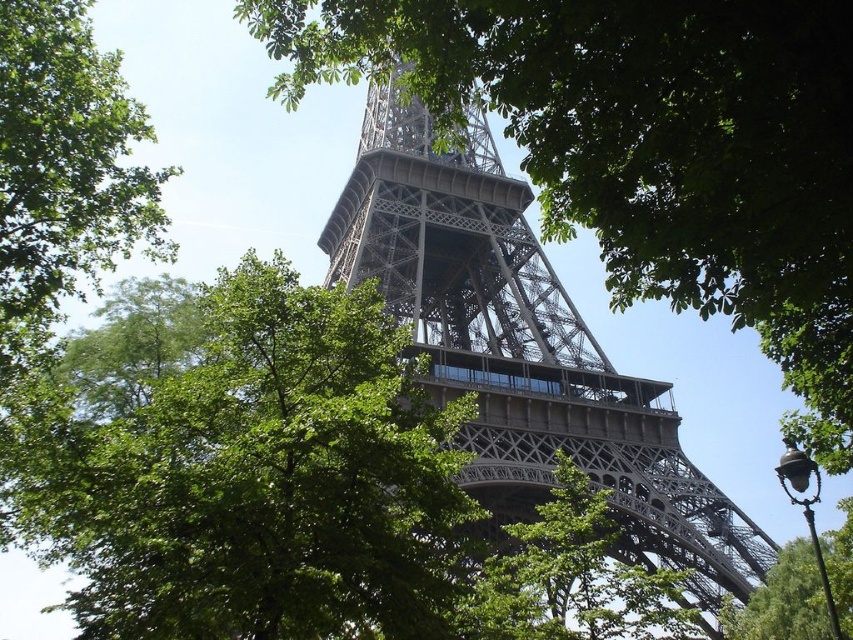
You are a photographer planning to capture the Eiffel Tower with the green leafy tree at center in the foreground. Given their sizes, will the tree block the view of the metallic gray tower at center in your photo?

The green leafy tree at center has a smaller size compared to metallic gray tower at center, so the tree will not block the view of the tower since it is smaller in size.

You are standing in front of the Eiffel Tower and want to take a photo. You notice two points marked on your camera screen at coordinates point (364, 177) and point (62, 0). Which point is closer to you?

Point (364, 177) is further to the viewer than point (62, 0), so the point closer to you is point (62, 0).

You are planning to take a photo of the metallic gray tower at center and the green leafy tree at upper left. Considering their sizes, which object should you focus on to ensure both fit in the frame without cropping?

The metallic gray tower at center is wider than the green leafy tree at upper left, so you should focus on the metallic gray tower at center to ensure both fit in the frame without cropping.